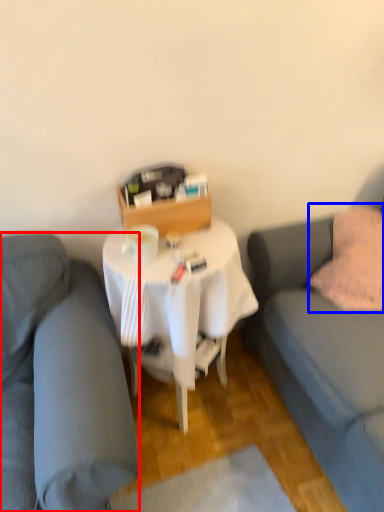
Question: Which object appears farthest to the camera in this image, studio couch (highlighted by a red box) or throw pillow (highlighted by a blue box)?

Choices:
 (A) studio couch
 (B) throw pillow

Answer: (B)